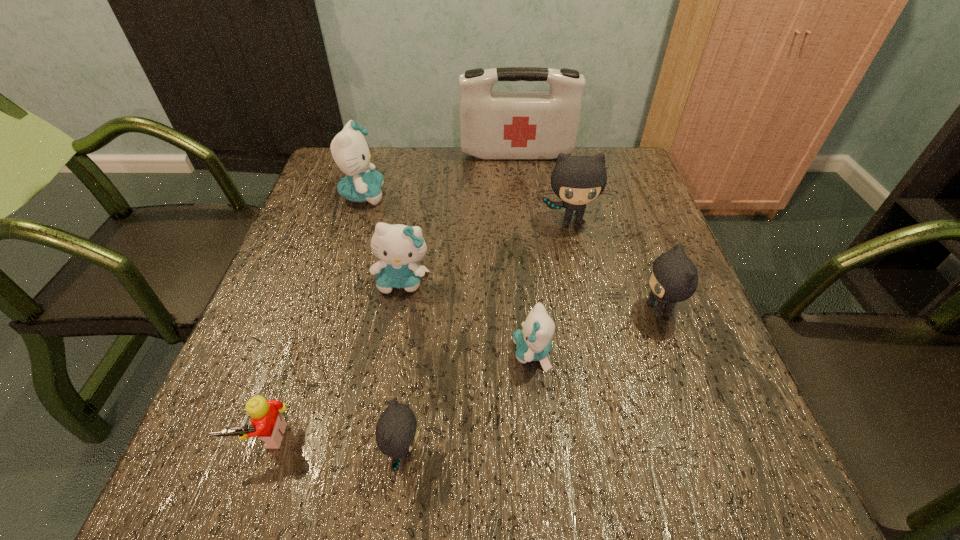
Where is `unoccupied area between the smallest gray kitten and the second biggest blue kitten`? The height and width of the screenshot is (540, 960). unoccupied area between the smallest gray kitten and the second biggest blue kitten is located at coordinates (403, 366).

This screenshot has height=540, width=960. What are the coordinates of `free space between the Lego and the rightmost blue kitten` in the screenshot? It's located at (398, 395).

Choose which object is the nearest neighbor to the red first-aid kit. Please provide its 2D coordinates. Your answer should be formatted as a tuple, i.e. [(x, y)], where the tuple contains the x and y coordinates of a point satisfying the conditions above.

[(350, 151)]

This screenshot has width=960, height=540. In order to click on object that ranks as the closest to the first-aid kit in this screenshot , I will do `click(350, 151)`.

Select which kitten appears as the fifth closest to the tallest object. Please provide its 2D coordinates. Your answer should be formatted as a tuple, i.e. [(x, y)], where the tuple contains the x and y coordinates of a point satisfying the conditions above.

[(533, 342)]

This screenshot has height=540, width=960. In order to click on the second closest kitten to the rightmost blue kitten in this screenshot , I will do `click(674, 278)`.

Identify which blue kitten is located as the nearest to the second gray kitten from left to right. Please provide its 2D coordinates. Your answer should be formatted as a tuple, i.e. [(x, y)], where the tuple contains the x and y coordinates of a point satisfying the conditions above.

[(398, 246)]

The height and width of the screenshot is (540, 960). In order to click on the closest blue kitten to the tallest object in this screenshot , I will do (350, 151).

Where is `gray kitten that is the second closest to the rightmost blue kitten`? gray kitten that is the second closest to the rightmost blue kitten is located at coordinates (674, 278).

Identify which gray kitten is the closest to the nearest kitten. Please provide its 2D coordinates. Your answer should be formatted as a tuple, i.e. [(x, y)], where the tuple contains the x and y coordinates of a point satisfying the conditions above.

[(674, 278)]